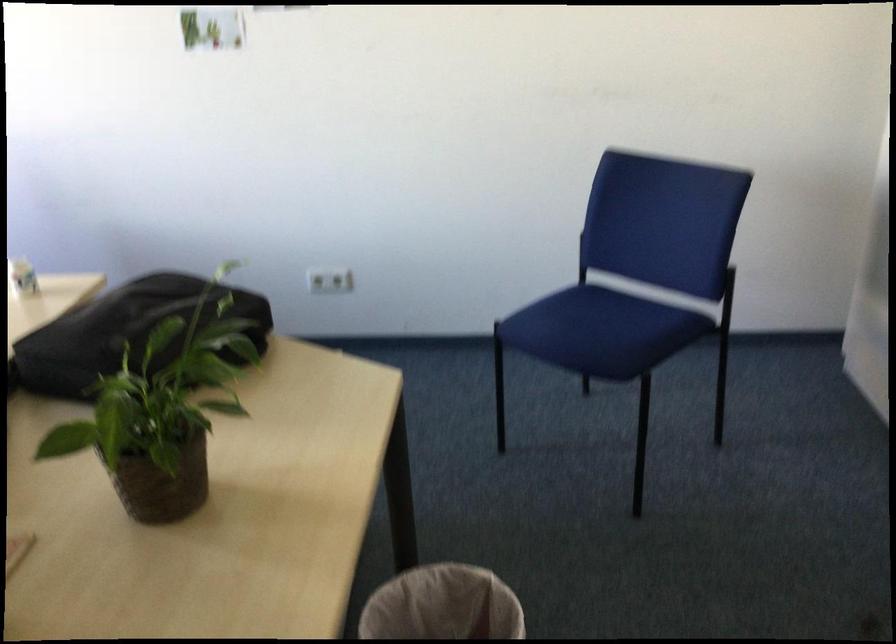
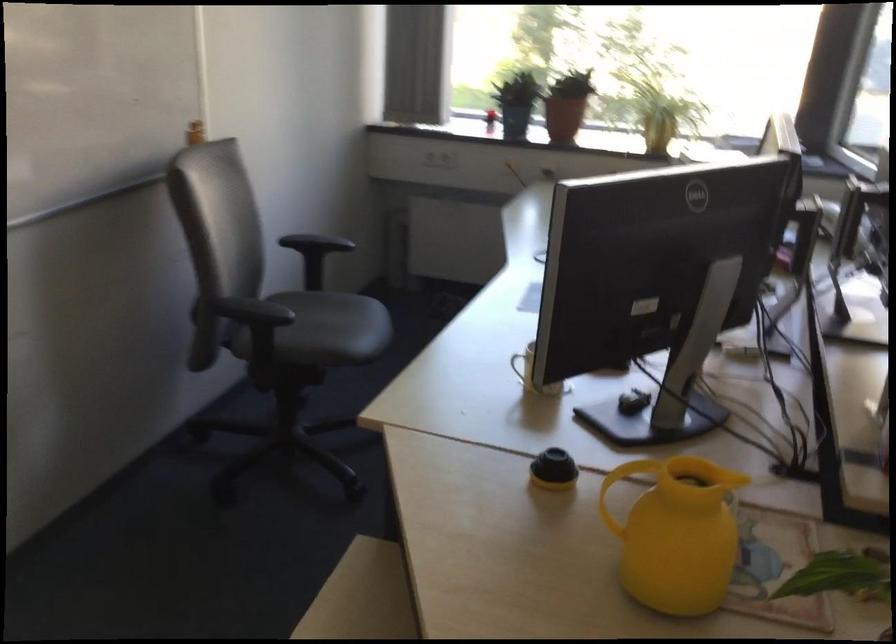
The first image is from the beginning of the video and the second image is from the end. How did the camera likely rotate when shooting the video?

The camera rotated toward left-down.